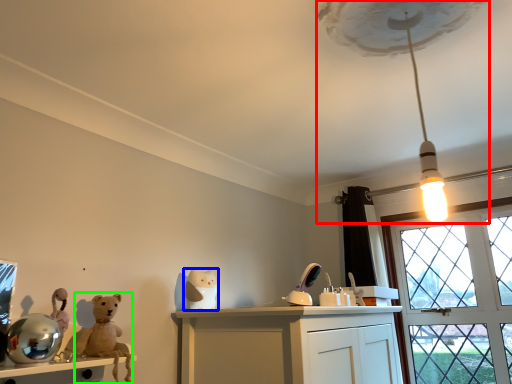
Question: Considering the real-world distances, which object is farthest from lamp (highlighted by a red box)? toy (highlighted by a blue box) or animal (highlighted by a green box)?

Choices:
 (A) toy
 (B) animal

Answer: (B)